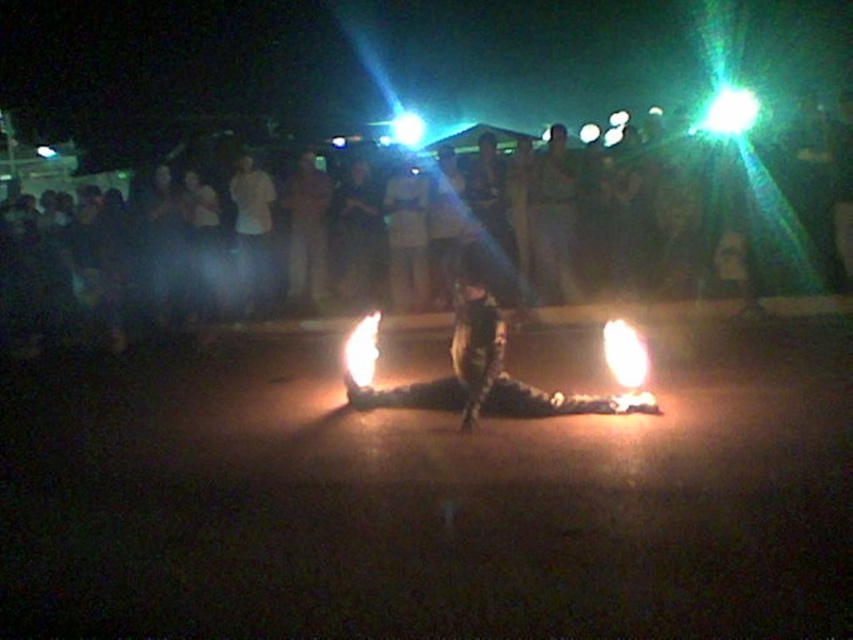
Who is shorter, dark clothing crowd at upper center or camouflage-patterned pants at center?

camouflage-patterned pants at center is shorter.

Is dark clothing crowd at upper center closer to camera compared to camouflage-patterned pants at center?

No.

Between point (428, 227) and point (451, 404), which one is positioned in front?

Positioned in front is point (451, 404).

Find the location of a particular element. dark clothing crowd at upper center is located at coordinates [x=438, y=241].

Is dark clothing crowd at upper center bigger than bright orange flame at center?

Indeed, dark clothing crowd at upper center has a larger size compared to bright orange flame at center.

Is dark clothing crowd at upper center behind bright orange flame at center?

No, dark clothing crowd at upper center is closer to the viewer.

I want to click on dark clothing crowd at upper center, so click(x=438, y=241).

Which is below, camouflage-patterned pants at center or bright orange flame at center?

bright orange flame at center

Identify the location of camouflage-patterned pants at center. (469, 369).